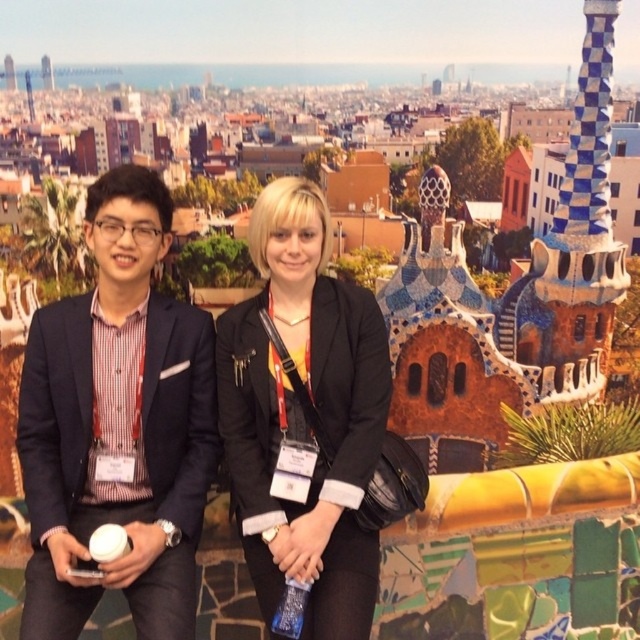
You are standing in front of the image and want to locate the matte black blazer at left. According to the coordinates provided, where exactly is it positioned?

The matte black blazer at left is located at point 0.666 along the horizontal axis and 0.184 along the vertical axis, as specified in the coordinates.

You are a security guard in a museum and need to check the distance between the two individuals to ensure social distancing. The minimum required distance is 6 feet. Can you confirm if the distance between the matte black blazer at left and the black matte jacket at center meets the requirement?

The distance between the matte black blazer at left and the black matte jacket at center is 20.15 feet, which is greater than the 6 feet requirement. Therefore, the social distancing guidelines are being followed.